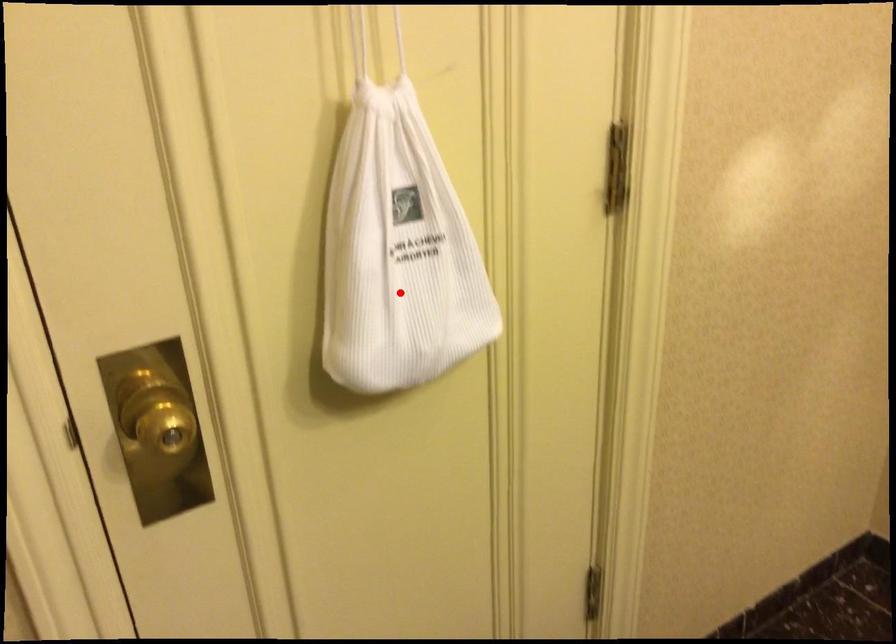
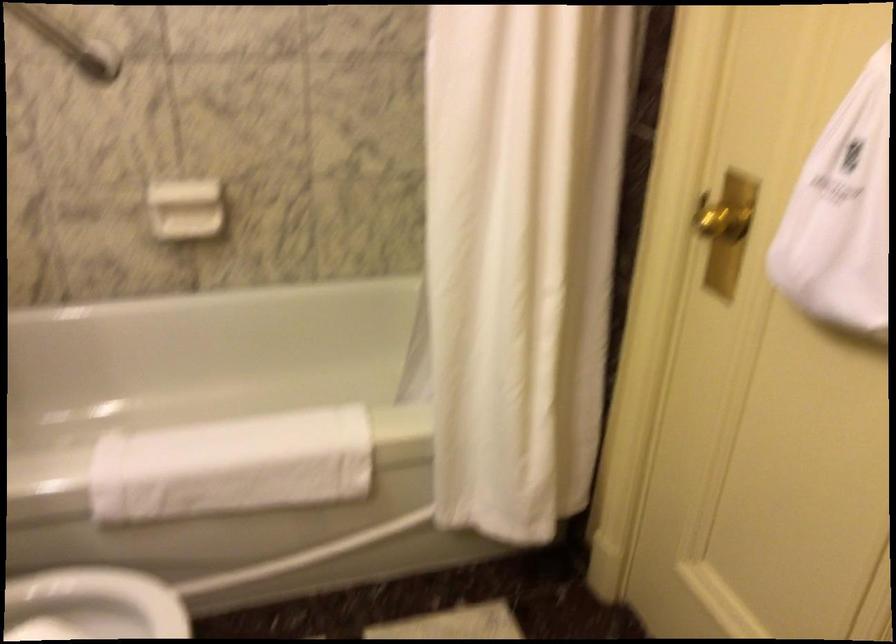
Question: I am providing you with two images of the same scene from different viewpoints. In image1, a red point is highlighted. Considering the same 3D point in image2, which of the following is correct?

Choices:
 (A) It is closer
 (B) It is farther

Answer: (B)